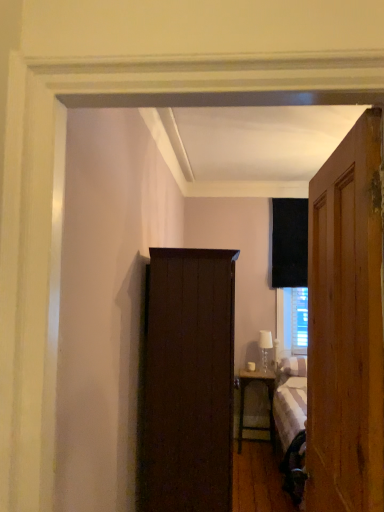
Question: Considering the positions of point (264, 335) and point (337, 410), is point (264, 335) closer or farther from the camera than point (337, 410)?

Choices:
 (A) closer
 (B) farther

Answer: (B)

Question: Considering the relative positions of white glass table lamp at right and wooden door at right in the image provided, is white glass table lamp at right to the left or to the right of wooden door at right?

Choices:
 (A) right
 (B) left

Answer: (A)

Question: Estimate the real-world distances between objects in this image. Which object is closer to the white glass table lamp at right?

Choices:
 (A) dark wood cupboard at left
 (B) wooden door at right
 (C) wooden nightstand at right

Answer: (C)

Question: Which object is positioned closest to the white glass table lamp at right?

Choices:
 (A) dark wood cupboard at left
 (B) wooden door at right
 (C) wooden nightstand at right

Answer: (C)